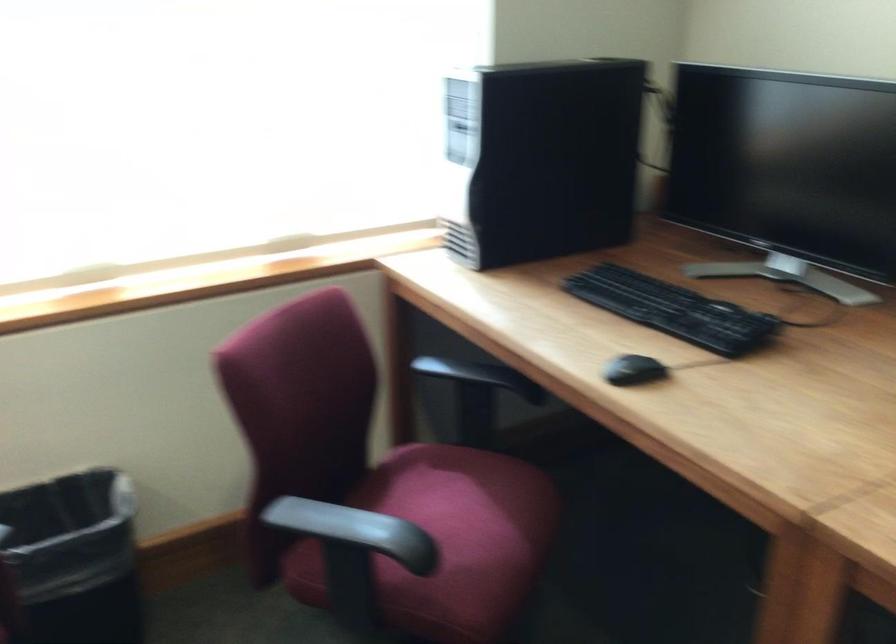
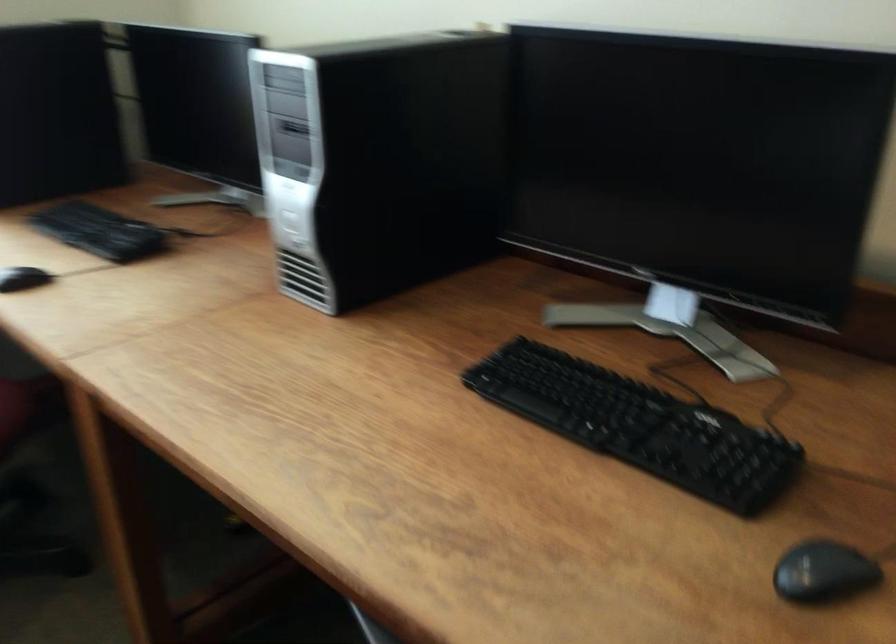
What movement of the cameraman would produce the second image?

The cameraman walked toward right, backward.